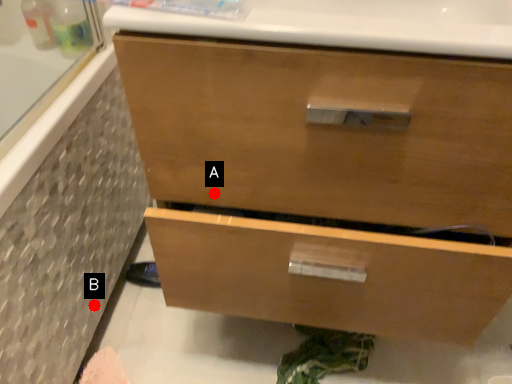
Question: Two points are circled on the image, labeled by A and B beside each circle. Which point is further to the camera?

Choices:
 (A) A is further
 (B) B is further

Answer: (B)